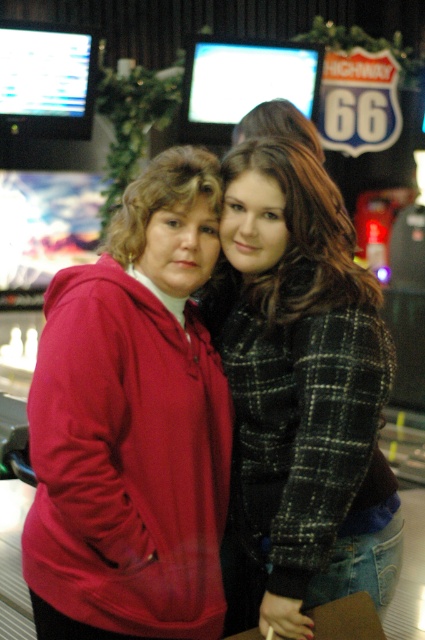
Which is more to the right, matte red hoodie at center or plaid fabric jacket at center?

plaid fabric jacket at center

Between matte red hoodie at center and plaid fabric jacket at center, which one appears on the left side from the viewer's perspective?

Positioned to the left is matte red hoodie at center.

Does point (170, 608) come closer to viewer compared to point (226, 538)?

Yes, point (170, 608) is closer to viewer.

At what (x,y) coordinates should I click in order to perform the action: click on matte red hoodie at center. Please return your answer as a coordinate pair (x, y). This screenshot has width=425, height=640. Looking at the image, I should click on (133, 422).

Is matte red hoodie at center shorter than dark brown hair at center?

No.

Does point (133, 268) come behind point (246, 125)?

No, (133, 268) is closer to viewer.

I want to click on matte red hoodie at center, so click(133, 422).

Does plaid fabric jacket at center have a lesser width compared to dark brown hair at center?

No.

Can you confirm if plaid fabric jacket at center is wider than dark brown hair at center?

Indeed, plaid fabric jacket at center has a greater width compared to dark brown hair at center.

Between point (248, 170) and point (317, 148), which one is positioned in front?

Positioned in front is point (248, 170).

This screenshot has width=425, height=640. What are the coordinates of `plaid fabric jacket at center` in the screenshot? It's located at (300, 392).